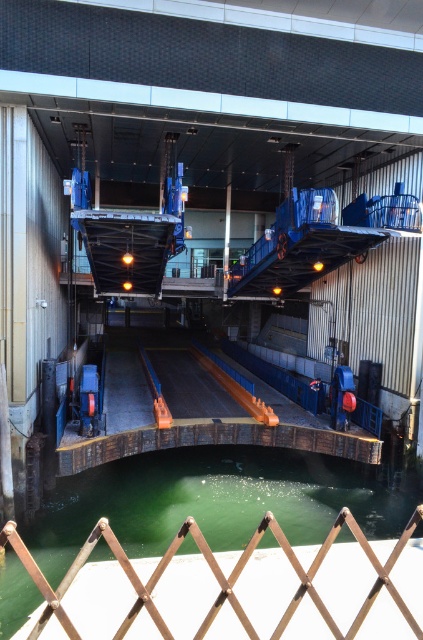
Question: Where is wooden dock at center located in relation to brown wooden fence at lower center in the image?

Choices:
 (A) below
 (B) above

Answer: (B)

Question: Does wooden dock at center have a smaller size compared to brown wooden fence at lower center?

Choices:
 (A) yes
 (B) no

Answer: (B)

Question: Which point is closer to the camera taking this photo?

Choices:
 (A) (258, 444)
 (B) (5, 525)

Answer: (B)

Question: Among these points, which one is farthest from the camera?

Choices:
 (A) (158, 628)
 (B) (233, 397)

Answer: (B)

Question: Can you confirm if wooden dock at center is positioned below brown wooden fence at lower center?

Choices:
 (A) no
 (B) yes

Answer: (A)